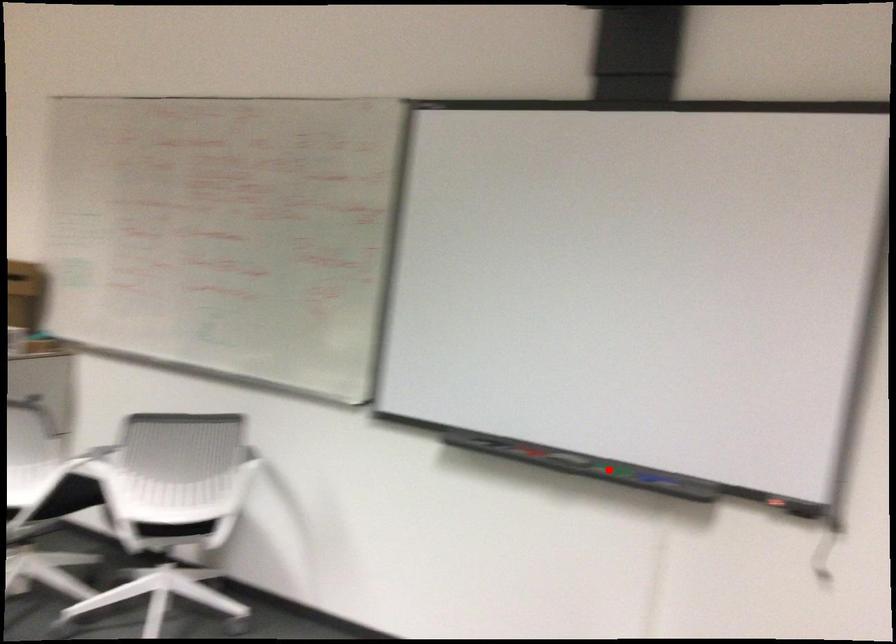
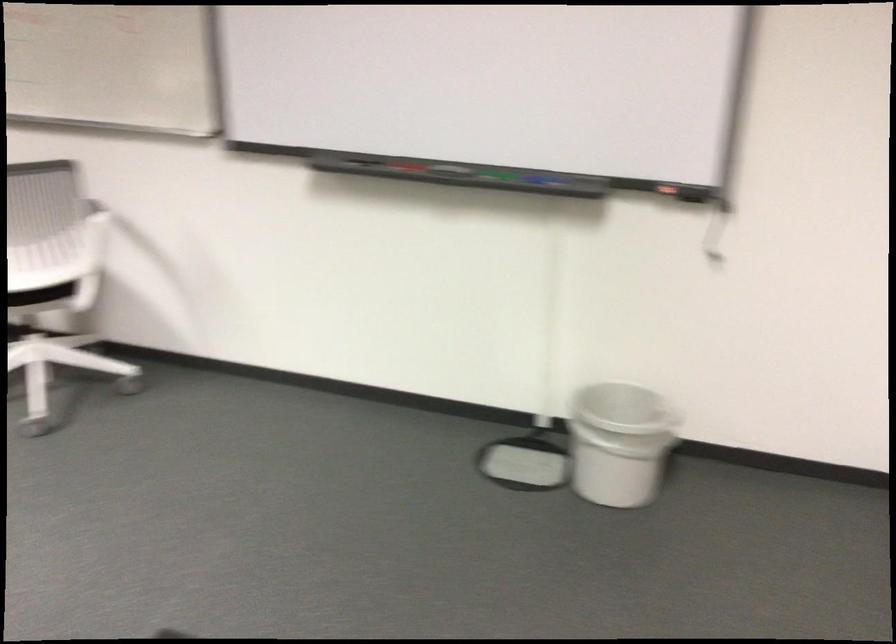
In the second image, find the point that corresponds to the highlighted location in the first image.

(492, 176)